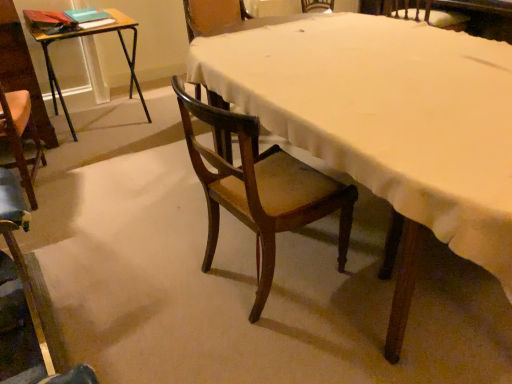
Question: Is wooden desk at left not close to wooden chair at center?

Choices:
 (A) no
 (B) yes

Answer: (B)

Question: Considering the relative sizes of wooden desk at left and wooden chair at center in the image provided, is wooden desk at left bigger than wooden chair at center?

Choices:
 (A) no
 (B) yes

Answer: (A)

Question: Is wooden desk at left surrounding wooden chair at center?

Choices:
 (A) no
 (B) yes

Answer: (A)

Question: Can you confirm if wooden desk at left is taller than wooden chair at center?

Choices:
 (A) yes
 (B) no

Answer: (B)

Question: From a real-world perspective, is wooden desk at left on top of wooden chair at center?

Choices:
 (A) yes
 (B) no

Answer: (B)

Question: Does wooden desk at left appear on the left side of wooden chair at center?

Choices:
 (A) no
 (B) yes

Answer: (B)

Question: From the image's perspective, would you say wooden chair at center is positioned over wooden chair at center, arranged as the second chair when viewed from the right?

Choices:
 (A) no
 (B) yes

Answer: (B)

Question: Would you say wooden chair at center, positioned as the third chair in left-to-right order, is part of wooden chair at center's contents?

Choices:
 (A) no
 (B) yes

Answer: (B)

Question: Is wooden chair at center located outside wooden chair at center, positioned as the third chair in left-to-right order?

Choices:
 (A) yes
 (B) no

Answer: (A)

Question: Is wooden chair at center wider than wooden chair at center, arranged as the second chair when viewed from the right?

Choices:
 (A) no
 (B) yes

Answer: (B)

Question: From the image's perspective, is wooden chair at center under wooden chair at center, arranged as the second chair when viewed from the right?

Choices:
 (A) yes
 (B) no

Answer: (B)

Question: Does wooden chair at center have a greater height compared to wooden chair at center, arranged as the second chair when viewed from the right?

Choices:
 (A) yes
 (B) no

Answer: (B)

Question: Can you confirm if wooden chair at center, arranged as the second chair when viewed from the right, is thinner than wooden desk at left?

Choices:
 (A) yes
 (B) no

Answer: (A)